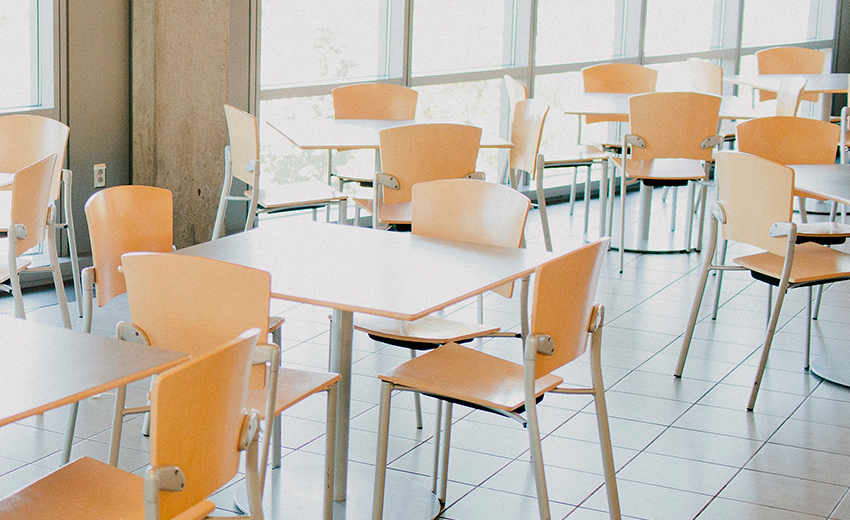
Where is `tabletops`? tabletops is located at coordinates [x=54, y=368], [x=386, y=269], [x=350, y=130], [x=4, y=212], [x=591, y=104], [x=826, y=82], [x=819, y=179].